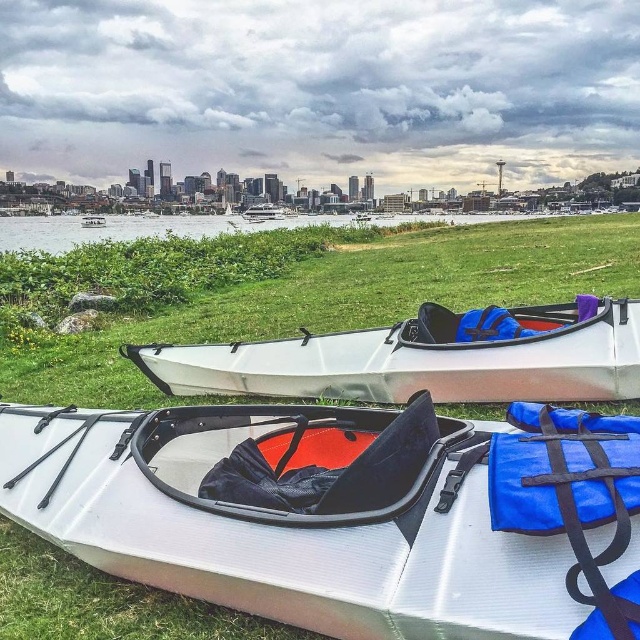
Which is more to the left, white water at center or white matte kayak at lower center?

white matte kayak at lower center is more to the left.

Which is above, white water at center or white matte kayak at lower center?

white matte kayak at lower center

What are the coordinates of `white water at center` in the screenshot? It's located at pos(136,228).

Which is behind, point (492, 390) or point (257, 209)?

Positioned behind is point (257, 209).

From the picture: Is white glossy kayak at center smaller than white glossy boat at center?

Yes.

Who is more distant from viewer, (547, 332) or (273, 211)?

Positioned behind is point (273, 211).

Where is `white glossy kayak at center`? This screenshot has width=640, height=640. white glossy kayak at center is located at coordinates (419, 360).

Is white glossy kayak at center to the right of white water at center from the viewer's perspective?

Indeed, white glossy kayak at center is positioned on the right side of white water at center.

Does point (560, 346) come farther from viewer compared to point (88, 230)?

No, it is not.

Image resolution: width=640 pixels, height=640 pixels. I want to click on white glossy kayak at center, so click(419, 360).